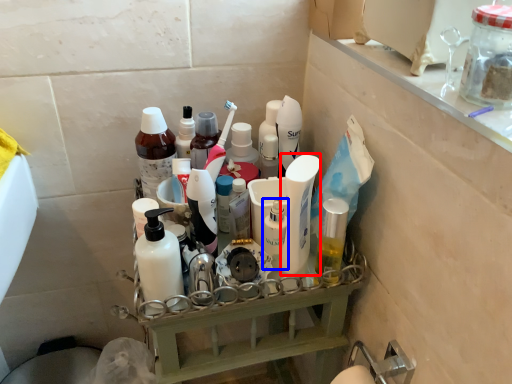
Question: Which point is closer to the camera, cleaning product (highlighted by a red box) or toiletry (highlighted by a blue box)?

Choices:
 (A) cleaning product
 (B) toiletry

Answer: (A)